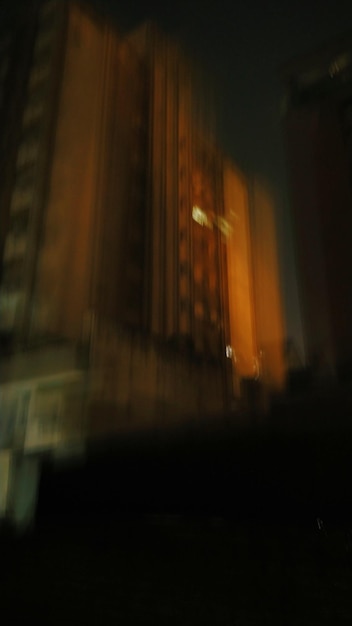
Locate an element on the screen. units with lights on is located at coordinates (196, 213), (229, 352).